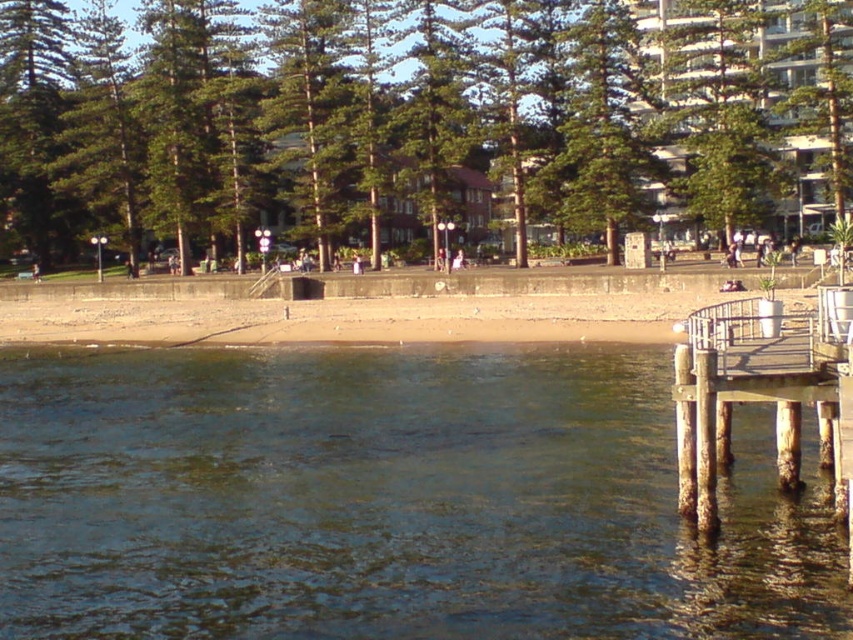
Question: Can you confirm if clear water at lower left is wider than green leafy tree at center?

Choices:
 (A) no
 (B) yes

Answer: (A)

Question: Which of the following is the closest to the observer?

Choices:
 (A) (685, 102)
 (B) (733, 388)
 (C) (364, 408)

Answer: (B)

Question: Estimate the real-world distances between objects in this image. Which object is farther from the clear water at lower left?

Choices:
 (A) green leafy tree at center
 (B) rusty wood dock at lower right

Answer: (A)

Question: Can you confirm if clear water at lower left is bigger than green leafy tree at center?

Choices:
 (A) no
 (B) yes

Answer: (A)

Question: Which object is positioned closest to the green leafy tree at center?

Choices:
 (A) clear water at lower left
 (B) rusty wood dock at lower right

Answer: (A)

Question: Is green leafy tree at center wider than rusty wood dock at lower right?

Choices:
 (A) yes
 (B) no

Answer: (A)